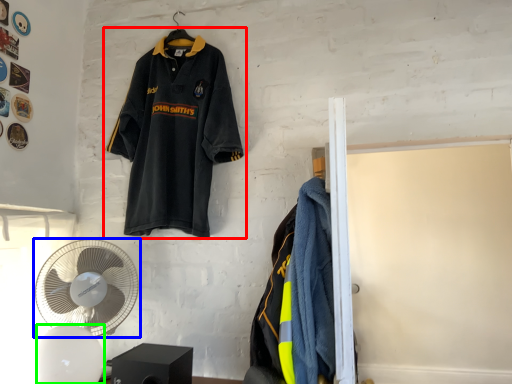
Question: Which is nearer to the sports uniform (highlighted by a red box)? mechanical fan (highlighted by a blue box) or mechanical fan (highlighted by a green box).

Choices:
 (A) mechanical fan
 (B) mechanical fan

Answer: (A)